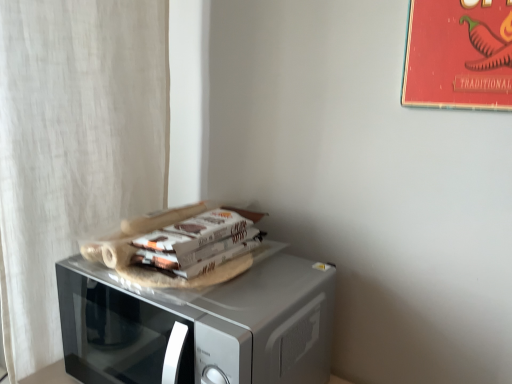
The width and height of the screenshot is (512, 384). Find the location of `white textured curtain at left`. white textured curtain at left is located at coordinates (74, 144).

What is the approximate width of white textured curtain at left?

white textured curtain at left is 5.38 inches wide.

The image size is (512, 384). What do you see at coordinates (199, 325) in the screenshot?
I see `silver metallic microwave at center` at bounding box center [199, 325].

The height and width of the screenshot is (384, 512). I want to click on silver metallic microwave at center, so click(x=199, y=325).

Where is `white textured curtain at left`? Image resolution: width=512 pixels, height=384 pixels. white textured curtain at left is located at coordinates (74, 144).

Could you tell me if red paper poster at upper right is facing silver metallic microwave at center?

No, red paper poster at upper right is not turned towards silver metallic microwave at center.

From the image's perspective, between red paper poster at upper right and silver metallic microwave at center, who is located below?

silver metallic microwave at center, from the image's perspective.

Based on their positions, is red paper poster at upper right located to the left or right of silver metallic microwave at center?

Based on their positions, red paper poster at upper right is located to the right of silver metallic microwave at center.

Which of these two, red paper poster at upper right or white textured curtain at left, is thinner?

Thinner between the two is red paper poster at upper right.

Is red paper poster at upper right bigger than white textured curtain at left?

No.

From the image's perspective, would you say red paper poster at upper right is shown under white textured curtain at left?

No.

At what (x,y) coordinates should I click in order to perform the action: click on bulletin board lying in front of the white textured curtain at left. Please return your answer as a coordinate pair (x, y). The image size is (512, 384). Looking at the image, I should click on click(x=459, y=55).

Locate an element on the screen. Image resolution: width=512 pixels, height=384 pixels. microwave oven located on the left of red paper poster at upper right is located at coordinates (199, 325).

From the image's perspective, which is below, silver metallic microwave at center or red paper poster at upper right?

silver metallic microwave at center.

Is red paper poster at upper right inside silver metallic microwave at center?

No, red paper poster at upper right is not inside silver metallic microwave at center.

Would you say white textured curtain at left is inside or outside red paper poster at upper right?

white textured curtain at left is not enclosed by red paper poster at upper right.

From the image's perspective, who appears lower, white textured curtain at left or red paper poster at upper right?

white textured curtain at left appears lower in the image.

Could you tell me if white textured curtain at left is turned towards red paper poster at upper right?

Yes, white textured curtain at left faces towards red paper poster at upper right.

Does point (46, 230) come in front of point (471, 23)?

No, it is not.

Does point (12, 59) lie in front of point (125, 354)?

Yes, it is.

From a real-world perspective, does white textured curtain at left sit lower than silver metallic microwave at center?

No, from a real-world perspective, white textured curtain at left is not below silver metallic microwave at center.

Where is `curtain above the silver metallic microwave at center (from the image's perspective)`? The image size is (512, 384). curtain above the silver metallic microwave at center (from the image's perspective) is located at coordinates (74, 144).

Which is less distant, (224,303) or (46,192)?

Point (224,303) is closer to the camera than point (46,192).

Who is smaller, silver metallic microwave at center or white textured curtain at left?

Smaller between the two is silver metallic microwave at center.

Which object is thinner, silver metallic microwave at center or white textured curtain at left?

Thinner between the two is white textured curtain at left.

At what (x,y) coordinates should I click in order to perform the action: click on bulletin board above the silver metallic microwave at center (from a real-world perspective). Please return your answer as a coordinate pair (x, y). Looking at the image, I should click on (459, 55).

Where is `bulletin board in front of the white textured curtain at left`? This screenshot has width=512, height=384. bulletin board in front of the white textured curtain at left is located at coordinates (459, 55).

Based on their spatial positions, is silver metallic microwave at center or red paper poster at upper right closer to white textured curtain at left?

The object closer to white textured curtain at left is silver metallic microwave at center.

Estimate the real-world distances between objects in this image. Which object is closer to silver metallic microwave at center, white textured curtain at left or red paper poster at upper right?

white textured curtain at left is closer to silver metallic microwave at center.

When comparing their distances from white textured curtain at left, does red paper poster at upper right or silver metallic microwave at center seem closer?

Among the two, silver metallic microwave at center is located nearer to white textured curtain at left.

Based on their spatial positions, is red paper poster at upper right or white textured curtain at left closer to silver metallic microwave at center?

The object closer to silver metallic microwave at center is white textured curtain at left.

Looking at the image, which one is located further to red paper poster at upper right, silver metallic microwave at center or white textured curtain at left?

white textured curtain at left.

Estimate the real-world distances between objects in this image. Which object is closer to red paper poster at upper right, white textured curtain at left or silver metallic microwave at center?

Among the two, silver metallic microwave at center is located nearer to red paper poster at upper right.

Find the location of `microwave oven between white textured curtain at left and red paper poster at upper right from left to right`. microwave oven between white textured curtain at left and red paper poster at upper right from left to right is located at coordinates click(199, 325).